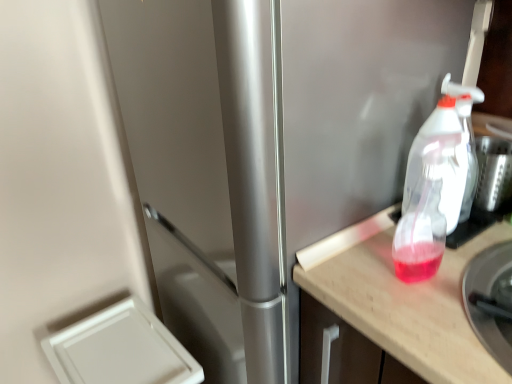
Question: Does metallic silver bowl at right, which is counted as the 2th appliance, starting from the bottom, appear on the right side of wooden countertop at right?

Choices:
 (A) yes
 (B) no

Answer: (A)

Question: Is metallic silver bowl at right, which is the second appliance from left to right, taller than wooden countertop at right?

Choices:
 (A) yes
 (B) no

Answer: (B)

Question: From a real-world perspective, is metallic silver bowl at right, which is counted as the 2th appliance, starting from the bottom, on wooden countertop at right?

Choices:
 (A) yes
 (B) no

Answer: (A)

Question: Would you consider metallic silver bowl at right, which ranks as the first appliance in top-to-bottom order, to be distant from wooden countertop at right?

Choices:
 (A) no
 (B) yes

Answer: (A)

Question: Is the surface of metallic silver bowl at right, which appears as the first appliance when viewed from the right, in direct contact with wooden countertop at right?

Choices:
 (A) no
 (B) yes

Answer: (A)

Question: Would you say metallic silver bowl at right, which is counted as the 2th appliance, starting from the bottom, is inside or outside wooden countertop at right?

Choices:
 (A) inside
 (B) outside

Answer: (A)

Question: Is metallic silver bowl at right, the 2th appliance when ordered from back to front, in front of or behind wooden countertop at right in the image?

Choices:
 (A) front
 (B) behind

Answer: (A)

Question: Is point 486,332 closer or farther from the camera than point 408,288?

Choices:
 (A) farther
 (B) closer

Answer: (B)

Question: From the image's perspective, relative to wooden countertop at right, is metallic silver bowl at right, which is the second appliance from left to right, above or below?

Choices:
 (A) above
 (B) below

Answer: (A)

Question: In terms of size, does white plastic drawer at lower left, which is counted as the second appliance, starting from the right, appear bigger or smaller than metallic silver bowl at right, which appears as the first appliance when viewed from the right?

Choices:
 (A) small
 (B) big

Answer: (B)

Question: Looking at their shapes, would you say white plastic drawer at lower left, the 2th appliance from the top, is wider or thinner than metallic silver bowl at right, which ranks as the first appliance in top-to-bottom order?

Choices:
 (A) wide
 (B) thin

Answer: (A)

Question: From a real-world perspective, is white plastic drawer at lower left, the 2th appliance from the top, physically located above or below metallic silver bowl at right, the first appliance viewed from the front?

Choices:
 (A) below
 (B) above

Answer: (A)

Question: Would you say white plastic drawer at lower left, arranged as the 1th appliance when viewed from the left, is inside or outside metallic silver bowl at right, the 2th appliance when ordered from back to front?

Choices:
 (A) inside
 (B) outside

Answer: (B)

Question: In the image, is white plastic drawer at lower left, acting as the first appliance starting from the back, positioned in front of or behind translucent plastic spray bottle at right?

Choices:
 (A) behind
 (B) front

Answer: (A)

Question: From a real-world perspective, is white plastic drawer at lower left, acting as the first appliance starting from the back, above or below translucent plastic spray bottle at right?

Choices:
 (A) below
 (B) above

Answer: (A)